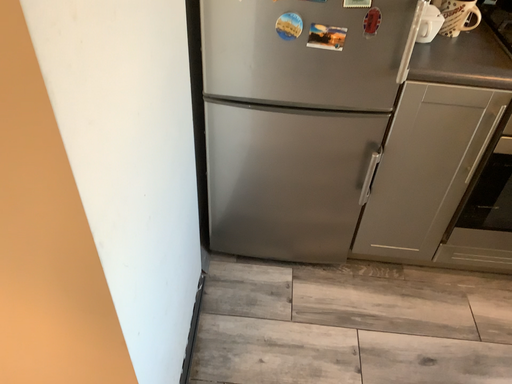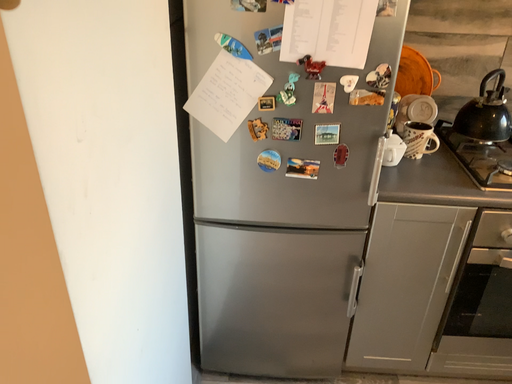
Question: Which way did the camera rotate in the video?

Choices:
 (A) rotated upward
 (B) rotated downward

Answer: (A)